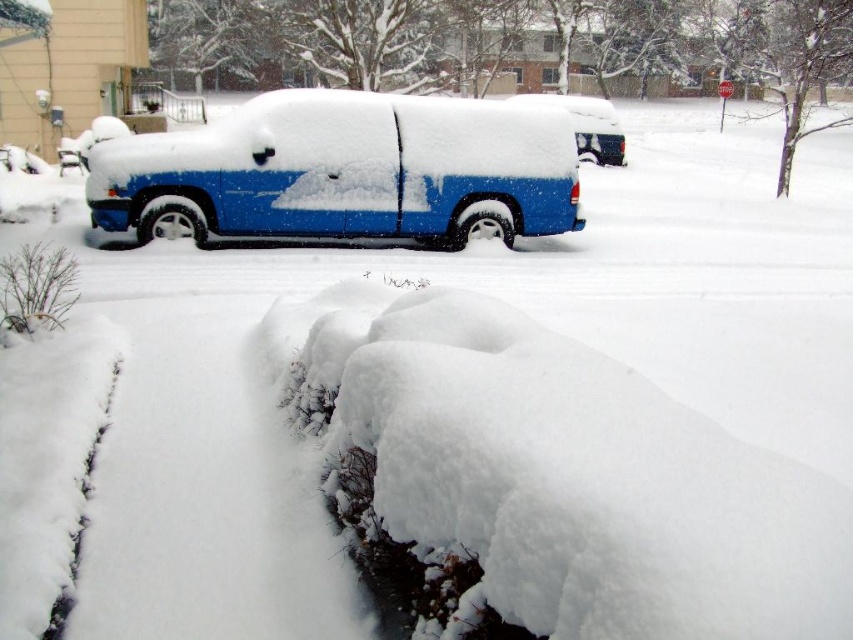
Question: Based on their relative distances, which object is farther from the white snow curb at lower left?

Choices:
 (A) blue matte van at center
 (B) blue matte van at upper center

Answer: (B)

Question: Which object is positioned closest to the blue matte van at upper center?

Choices:
 (A) white snow curb at lower left
 (B) blue matte van at center

Answer: (B)

Question: Which point is closer to the camera taking this photo?

Choices:
 (A) (183, 189)
 (B) (62, 630)
 (C) (599, 148)

Answer: (B)

Question: Does blue matte van at upper center appear on the right side of white snow curb at lower left?

Choices:
 (A) no
 (B) yes

Answer: (B)

Question: Where is blue matte van at center located in relation to white snow curb at lower left in the image?

Choices:
 (A) right
 (B) left

Answer: (A)

Question: Does blue matte van at center have a greater width compared to blue matte van at upper center?

Choices:
 (A) no
 (B) yes

Answer: (B)